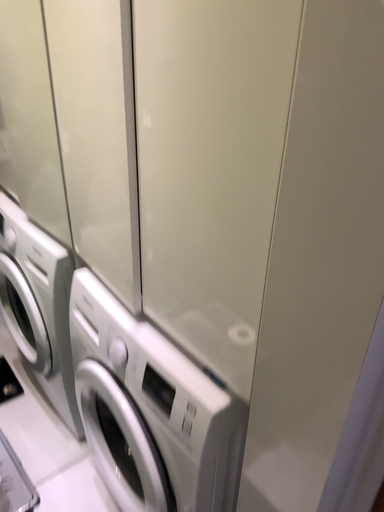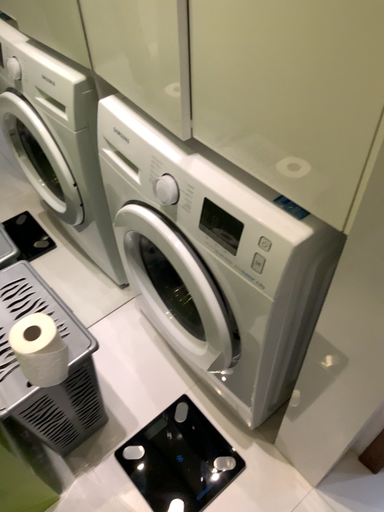
Question: Which way did the camera rotate in the video?

Choices:
 (A) rotated downward
 (B) rotated upward

Answer: (A)